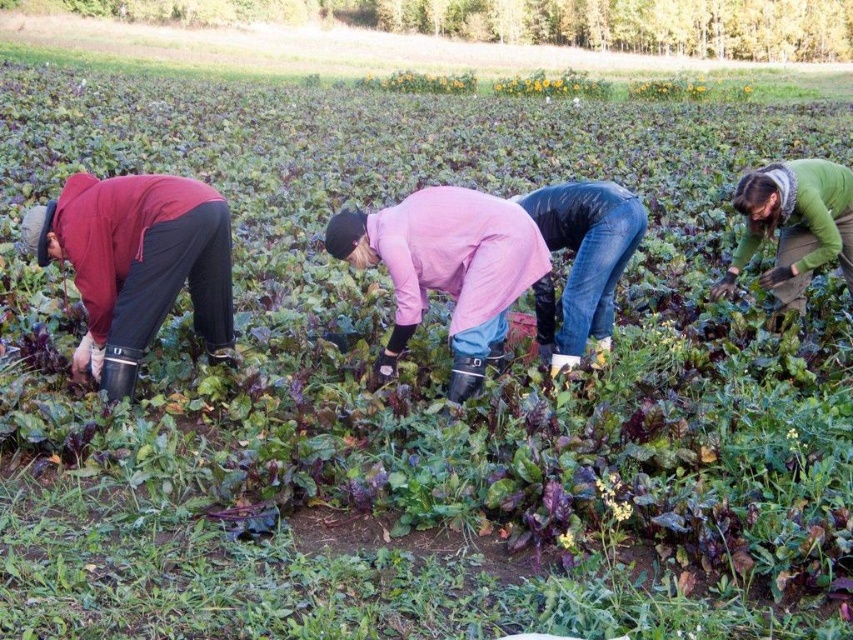
This screenshot has height=640, width=853. What do you see at coordinates (582, 260) in the screenshot? I see `jeans at center` at bounding box center [582, 260].

Which is behind, point (563, 188) or point (808, 209)?

The point (808, 209) is more distant.

Image resolution: width=853 pixels, height=640 pixels. What are the coordinates of `jeans at center` in the screenshot? It's located at (582, 260).

Is pink matte jacket at center shorter than green matte jacket at right?

Incorrect, pink matte jacket at center's height does not fall short of green matte jacket at right's.

Is point (540, 236) in front of point (761, 204)?

Yes, it is.

Who is more forward, (506, 253) or (790, 193)?

Point (506, 253) is more forward.

The width and height of the screenshot is (853, 640). In order to click on pink matte jacket at center in this screenshot , I will do `click(445, 269)`.

Can you confirm if matte red jacket at left is shorter than pink matte jacket at center?

Indeed, matte red jacket at left has a lesser height compared to pink matte jacket at center.

Does matte red jacket at left come in front of pink matte jacket at center?

Yes, it is.

Who is more distant from viewer, (137, 260) or (456, 310)?

The point (456, 310) is behind.

Identify the location of matte red jacket at left. The width and height of the screenshot is (853, 640). (137, 264).